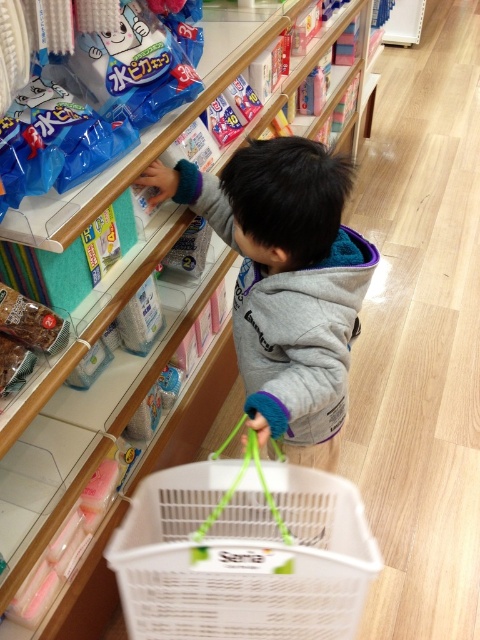
Question: In this image, where is white plastic basket at lower center located relative to brown textured snack at lower left?

Choices:
 (A) above
 (B) below

Answer: (B)

Question: Does gray fleece sweatshirt at center appear on the left side of brown textured snack at lower left?

Choices:
 (A) no
 (B) yes

Answer: (A)

Question: Which object is farther from the camera taking this photo?

Choices:
 (A) gray fleece sweatshirt at center
 (B) white plastic basket at lower center
 (C) brown textured snack at lower left

Answer: (C)

Question: Is gray fleece sweatshirt at center positioned in front of brown textured snack at lower left?

Choices:
 (A) no
 (B) yes

Answer: (B)

Question: Which point appears farthest from the camera in this image?

Choices:
 (A) (33, 365)
 (B) (210, 472)

Answer: (B)

Question: Which object is closer to the camera taking this photo?

Choices:
 (A) white plastic basket at lower center
 (B) gray fleece sweatshirt at center
 (C) brown textured snack at lower left

Answer: (A)